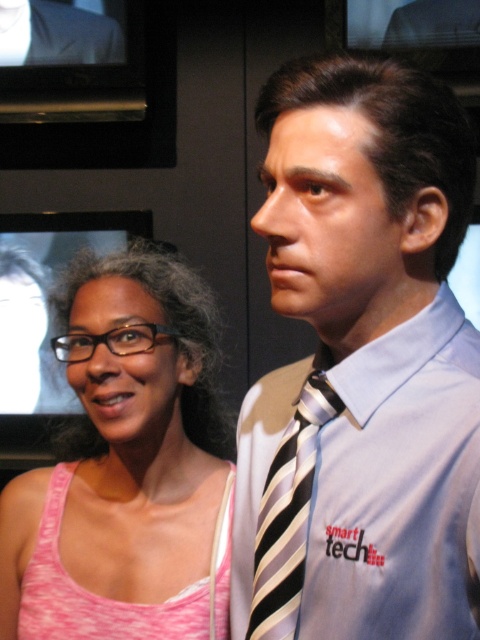
You are attending a corporate event and need to determine which clothing item occupies more visual space in the image. Based on the scene description, which one is larger between the smooth gray shirt at center and the matte black suit at upper left?

The smooth gray shirt at center has a larger size compared to the matte black suit at upper left, so the smooth gray shirt at center occupies more visual space in the image.

You are standing in the scene and want to move from point A to point B. Point A is at coordinates point (315, 378) and point B is at coordinates point (32, 20). Which direction should you move to go from point A to point B?

To move from point A at coordinates point (315, 378) to point B at coordinates point (32, 20), you should move diagonally towards the upper left direction since point A is in front of point B.

Looking at this image, you are an event planner organizing a formal gala. You have two items to place on a table for a display. The striped silk tie at center and the matte black suit at upper left. The table has limited vertical space. Which item should you place first to ensure both fit vertically?

The striped silk tie at center is taller than the matte black suit at upper left, so you should place the taller striped silk tie at center first to ensure both items fit vertically on the table.